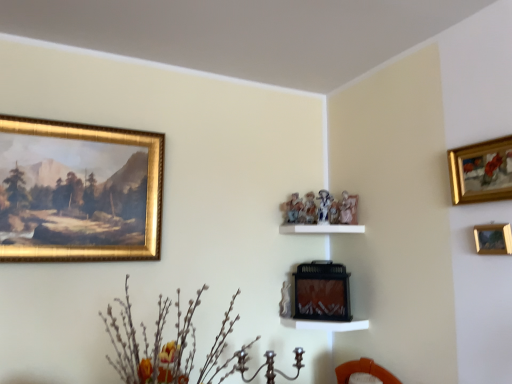
Question: Does gold-framed painting at upper left, the third picture frame viewed from the front, appear on the left side of wooden picture frame at upper right, which is the 3th picture frame from back to front?

Choices:
 (A) no
 (B) yes

Answer: (B)

Question: Considering the relative sizes of gold-framed painting at upper left, acting as the second picture frame starting from the back, and wooden picture frame at upper right, the second picture frame when ordered from front to back, in the image provided, is gold-framed painting at upper left, acting as the second picture frame starting from the back, taller than wooden picture frame at upper right, the second picture frame when ordered from front to back,?

Choices:
 (A) yes
 (B) no

Answer: (A)

Question: Considering the relative sizes of gold-framed painting at upper left, acting as the second picture frame starting from the back, and wooden picture frame at upper right, acting as the 3th picture frame starting from the left, in the image provided, is gold-framed painting at upper left, acting as the second picture frame starting from the back, shorter than wooden picture frame at upper right, acting as the 3th picture frame starting from the left,?

Choices:
 (A) yes
 (B) no

Answer: (B)

Question: From the image's perspective, is gold-framed painting at upper left, the fourth picture frame positioned from the right, below wooden picture frame at upper right, the second picture frame when ordered from front to back?

Choices:
 (A) no
 (B) yes

Answer: (A)

Question: Is gold-framed painting at upper left, the third picture frame viewed from the front, positioned behind wooden picture frame at upper right, the second picture frame when ordered from front to back?

Choices:
 (A) yes
 (B) no

Answer: (A)

Question: Looking at their shapes, would you say matte black fireplace at center, acting as the fourth picture frame starting from the front, is wider or thinner than gold-framed painting at upper right, the first picture frame viewed from the right?

Choices:
 (A) thin
 (B) wide

Answer: (B)

Question: Considering the positions of matte black fireplace at center, which ranks as the 1th picture frame in back-to-front order, and gold-framed painting at upper right, positioned as the first picture frame in front-to-back order, in the image, is matte black fireplace at center, which ranks as the 1th picture frame in back-to-front order, bigger or smaller than gold-framed painting at upper right, positioned as the first picture frame in front-to-back order,?

Choices:
 (A) big
 (B) small

Answer: (A)

Question: Is matte black fireplace at center, acting as the fourth picture frame starting from the front, to the left or to the right of gold-framed painting at upper right, positioned as the first picture frame in front-to-back order, in the image?

Choices:
 (A) left
 (B) right

Answer: (A)

Question: Is matte black fireplace at center, the 3th picture frame viewed from the right, taller or shorter than gold-framed painting at upper right, the first picture frame viewed from the right?

Choices:
 (A) tall
 (B) short

Answer: (A)

Question: From a real-world perspective, is gold-framed painting at upper left, the first picture frame in the left-to-right sequence, positioned above or below silvery metallic branches at lower left?

Choices:
 (A) above
 (B) below

Answer: (A)

Question: In the image, is gold-framed painting at upper left, the fourth picture frame positioned from the right, positioned in front of or behind silvery metallic branches at lower left?

Choices:
 (A) front
 (B) behind

Answer: (B)

Question: Is point (90, 130) closer or farther from the camera than point (142, 324)?

Choices:
 (A) farther
 (B) closer

Answer: (B)

Question: Would you say gold-framed painting at upper left, the fourth picture frame positioned from the right, is inside or outside silvery metallic branches at lower left?

Choices:
 (A) outside
 (B) inside

Answer: (A)

Question: Is gold-framed painting at upper right, the fourth picture frame when ordered from left to right, in front of or behind gold-framed painting at upper left, the fourth picture frame positioned from the right, in the image?

Choices:
 (A) behind
 (B) front

Answer: (B)

Question: Is gold-framed painting at upper right, the fourth picture frame positioned from the back, to the left or to the right of gold-framed painting at upper left, the first picture frame in the left-to-right sequence, in the image?

Choices:
 (A) left
 (B) right

Answer: (B)